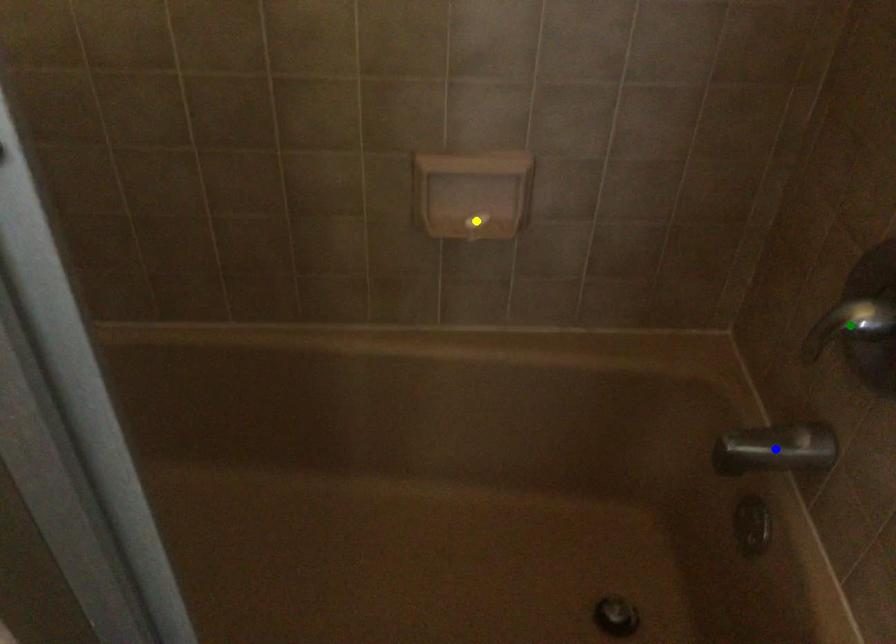
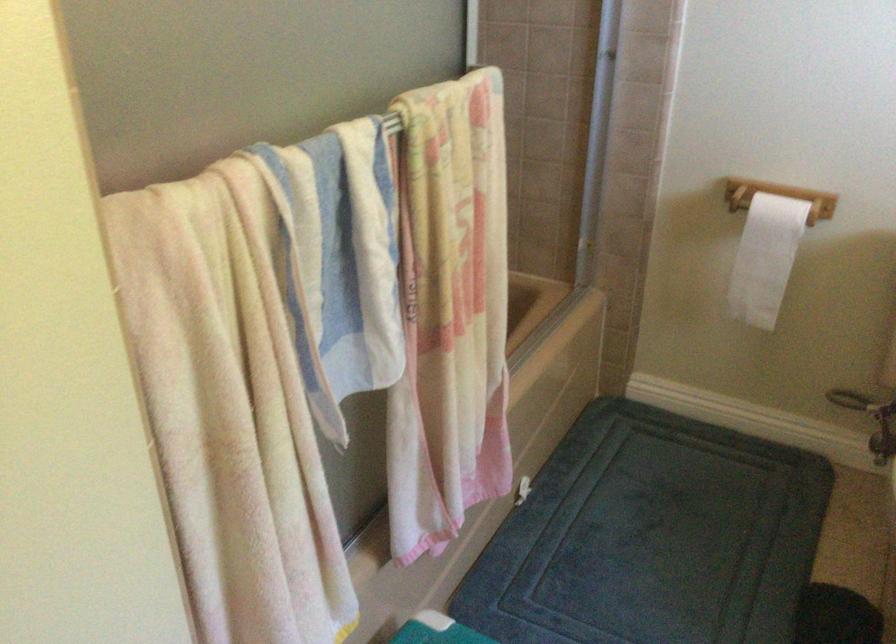
I am providing you with two images of the same scene from different viewpoints. Three points are marked in image1. Which point corresponds to a part or object that is occluded in image2?In image1, three points are marked. Which of them correspond to a part or object that is occluded in image2?Among the three points shown in image1, which one corresponds to a part or object that is no longer visible due to occlusion in image2?

blue point, green point, yellow point